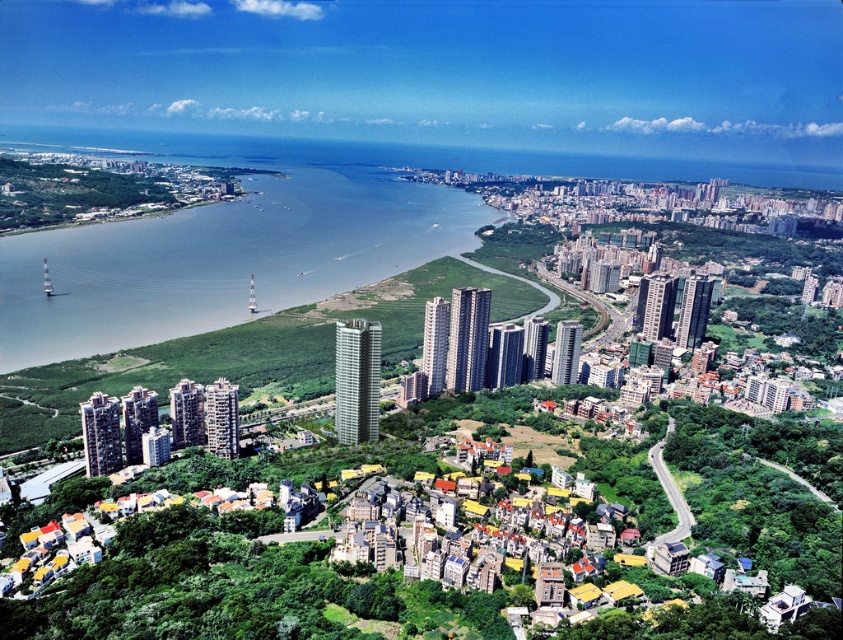
Question: Which object appears closest to the camera in this image?

Choices:
 (A) green grassy hillside at lower left
 (B) gray water at center

Answer: (A)

Question: Among these points, which one is nearest to the camera?

Choices:
 (A) (310, 317)
 (B) (164, 246)

Answer: (A)

Question: Can you confirm if gray water at center is positioned above green grassy hillside at lower left?

Choices:
 (A) no
 (B) yes

Answer: (B)

Question: Is gray water at center smaller than green grassy hillside at lower left?

Choices:
 (A) yes
 (B) no

Answer: (B)

Question: In this image, where is gray water at center located relative to green grassy hillside at lower left?

Choices:
 (A) below
 (B) above

Answer: (B)